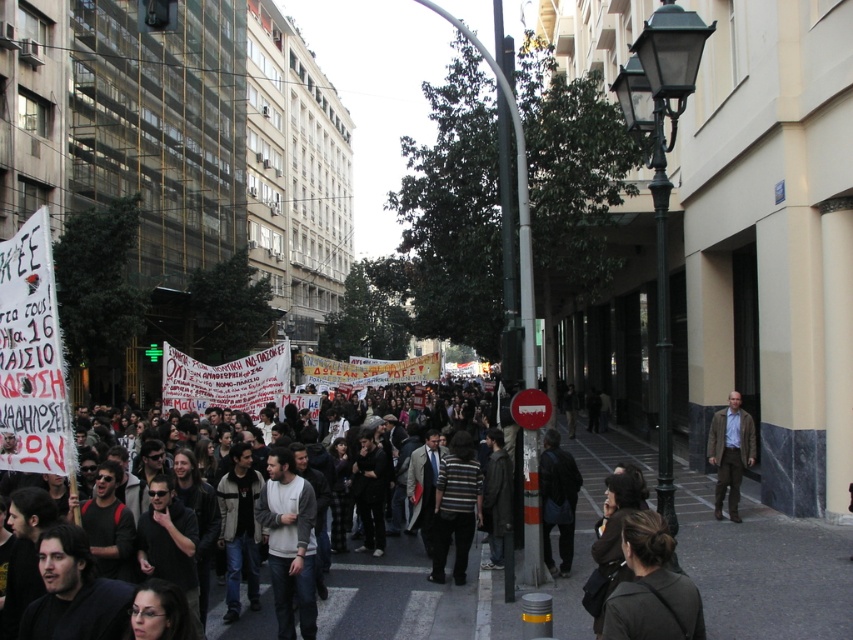
You are a photographer standing at the edge of a protest crowd. You want to capture a clear photo of the dark gray clothing at center without including any nearby protesters. Given that your camera has a maximum zoom range of 10 meters, can you take the photo from your current position?

The dark gray clothing at center is 8.38 meters away from the camera. Since the maximum zoom range is 10 meters, the photographer can take the photo from the current position as the distance is within the camera capability.